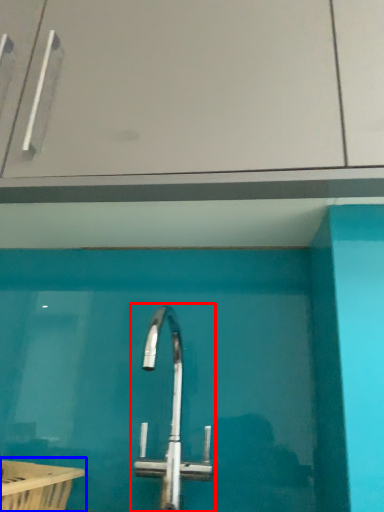
Question: Which object is closer to the camera taking this photo, tap (highlighted by a red box) or bath (highlighted by a blue box)?

Choices:
 (A) tap
 (B) bath

Answer: (B)